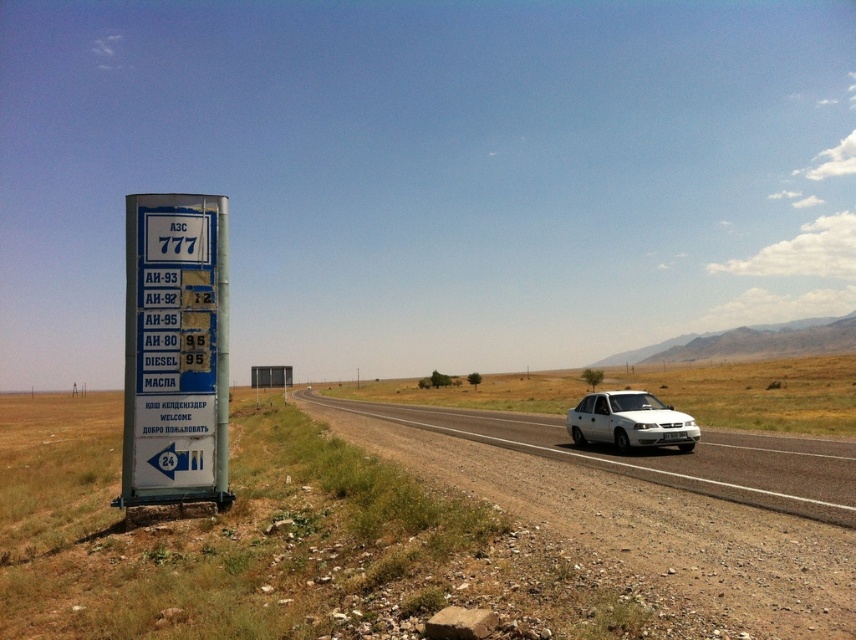
Question: Does white glossy car at center lie in front of white matte sedan at right?

Choices:
 (A) yes
 (B) no

Answer: (A)

Question: Which object appears farthest from the camera in this image?

Choices:
 (A) blue plastic sign at left
 (B) white matte sedan at right
 (C) white glossy car at center

Answer: (B)

Question: Among these objects, which one is farthest from the camera?

Choices:
 (A) blue plastic sign at left
 (B) white glossy car at center
 (C) white matte sedan at right

Answer: (C)

Question: Is white glossy car at center bigger than white matte sedan at right?

Choices:
 (A) no
 (B) yes

Answer: (B)

Question: Considering the relative positions of blue plastic sign at left and white matte sedan at right in the image provided, where is blue plastic sign at left located with respect to white matte sedan at right?

Choices:
 (A) right
 (B) left

Answer: (B)

Question: Which point is closer to the camera taking this photo?

Choices:
 (A) (840, 451)
 (B) (679, 412)
 (C) (135, 252)

Answer: (C)